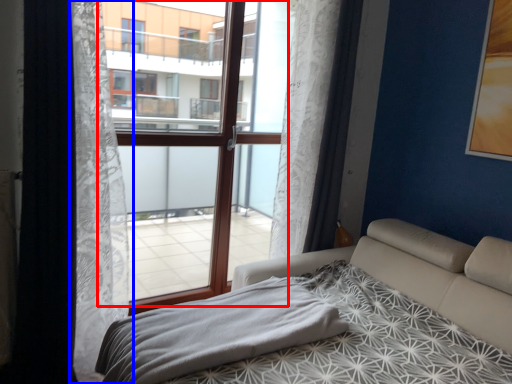
Question: Among these objects, which one is nearest to the camera, window frame (highlighted by a red box) or curtain (highlighted by a blue box)?

Choices:
 (A) window frame
 (B) curtain

Answer: (B)